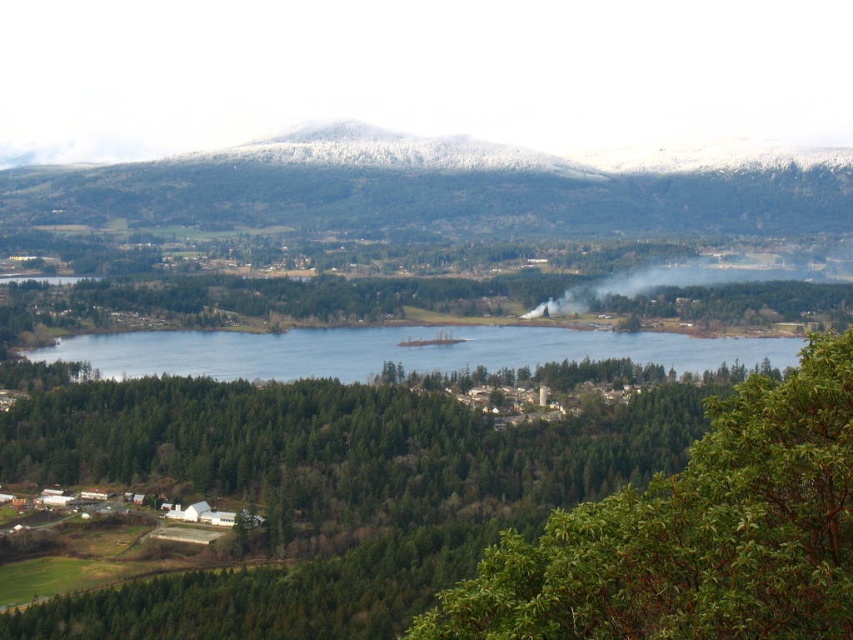
Question: Is green leafy tree at center below blue water at center?

Choices:
 (A) yes
 (B) no

Answer: (A)

Question: Which point is closer to the camera?

Choices:
 (A) green leafy tree at center
 (B) blue water at center

Answer: (A)

Question: Can you confirm if green leafy tree at center is bigger than blue water at center?

Choices:
 (A) no
 (B) yes

Answer: (B)

Question: Does green leafy tree at center come behind blue water at center?

Choices:
 (A) no
 (B) yes

Answer: (A)

Question: Which object appears closest to the camera in this image?

Choices:
 (A) blue water at center
 (B) green leafy tree at center

Answer: (B)